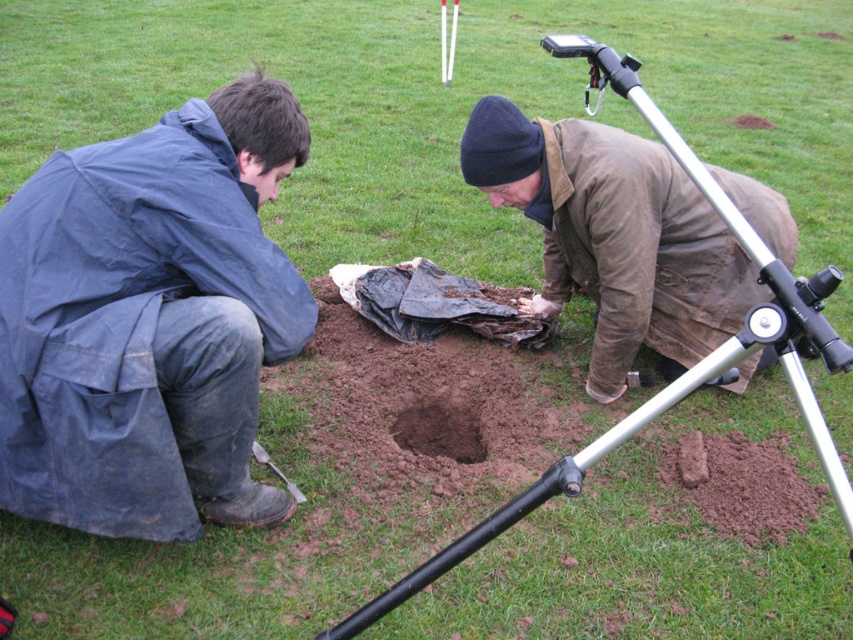
Question: Does brown leather jacket at center have a lesser width compared to brown dirt hole at center?

Choices:
 (A) no
 (B) yes

Answer: (A)

Question: Is brown leather jacket at center bigger than metallic silver shovel at lower left?

Choices:
 (A) no
 (B) yes

Answer: (B)

Question: Which of the following is the closest to the observer?

Choices:
 (A) black plastic video camera at upper center
 (B) blue waterproof jacket at left
 (C) brown dirt hole at center
 (D) brown leather jacket at center

Answer: (A)

Question: Which object is closer to the camera taking this photo?

Choices:
 (A) blue waterproof jacket at left
 (B) black plastic video camera at upper center
 (C) metallic silver shovel at lower left

Answer: (B)

Question: Is brown leather jacket at center positioned in front of black plastic video camera at upper center?

Choices:
 (A) yes
 (B) no

Answer: (B)

Question: Considering the real-world distances, which object is farthest from the blue waterproof jacket at left?

Choices:
 (A) brown dirt hole at center
 (B) brown leather jacket at center

Answer: (B)